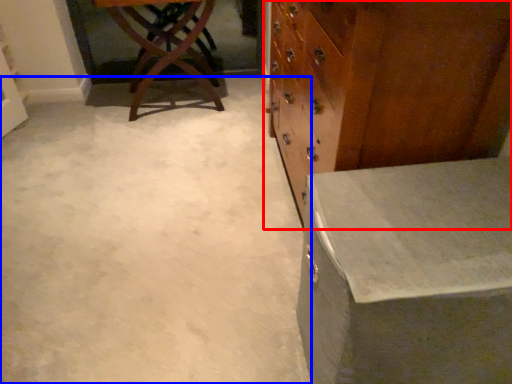
Question: Which object is closer to the camera taking this photo, chest of drawers (highlighted by a red box) or concrete (highlighted by a blue box)?

Choices:
 (A) chest of drawers
 (B) concrete

Answer: (A)